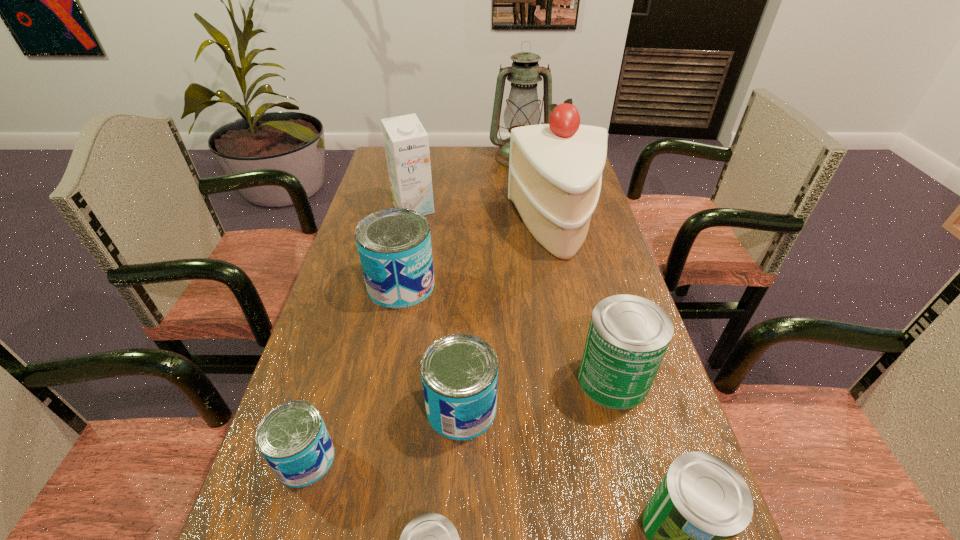
At what (x,y) coordinates should I click in order to perform the action: click on oil lamp. Please return your answer as a coordinate pair (x, y). The height and width of the screenshot is (540, 960). Looking at the image, I should click on (522, 109).

This screenshot has width=960, height=540. What are the coordinates of `the tallest object` in the screenshot? It's located at (522, 109).

Locate an element on the screen. The height and width of the screenshot is (540, 960). the eighth shortest object is located at coordinates (555, 170).

Locate an element on the screen. This screenshot has height=540, width=960. carton is located at coordinates (406, 142).

This screenshot has height=540, width=960. Find the location of `the sixth nearest object`. the sixth nearest object is located at coordinates (394, 245).

Image resolution: width=960 pixels, height=540 pixels. In order to click on the biggest blue can in this screenshot , I will do `click(394, 245)`.

Where is `the biggest green can`? The height and width of the screenshot is (540, 960). the biggest green can is located at coordinates (628, 336).

The width and height of the screenshot is (960, 540). Identify the location of the rightmost blue can. (459, 372).

This screenshot has height=540, width=960. Find the location of `the smallest blue can`. the smallest blue can is located at coordinates (293, 439).

Find the location of `blank space located on the left of the tallest object`. blank space located on the left of the tallest object is located at coordinates (463, 158).